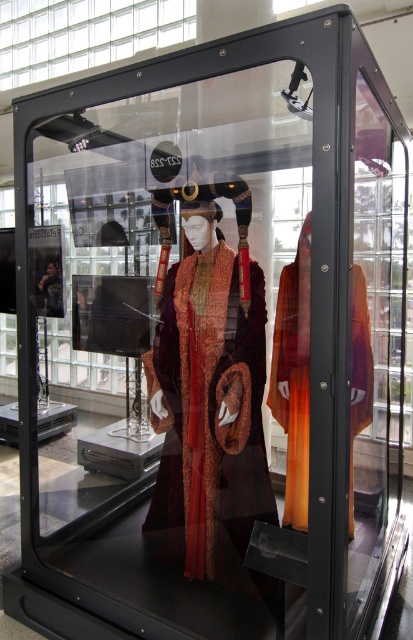
Does velvet-like burgundy dress at center have a larger size compared to velvet orange dress at center?

Yes, velvet-like burgundy dress at center is bigger than velvet orange dress at center.

Between velvet-like burgundy dress at center and velvet orange dress at center, which one is positioned higher?

velvet-like burgundy dress at center is above.

What do you see at coordinates (208, 388) in the screenshot? The image size is (413, 640). I see `velvet-like burgundy dress at center` at bounding box center [208, 388].

Where is `velvet-like burgundy dress at center`? velvet-like burgundy dress at center is located at coordinates (208, 388).